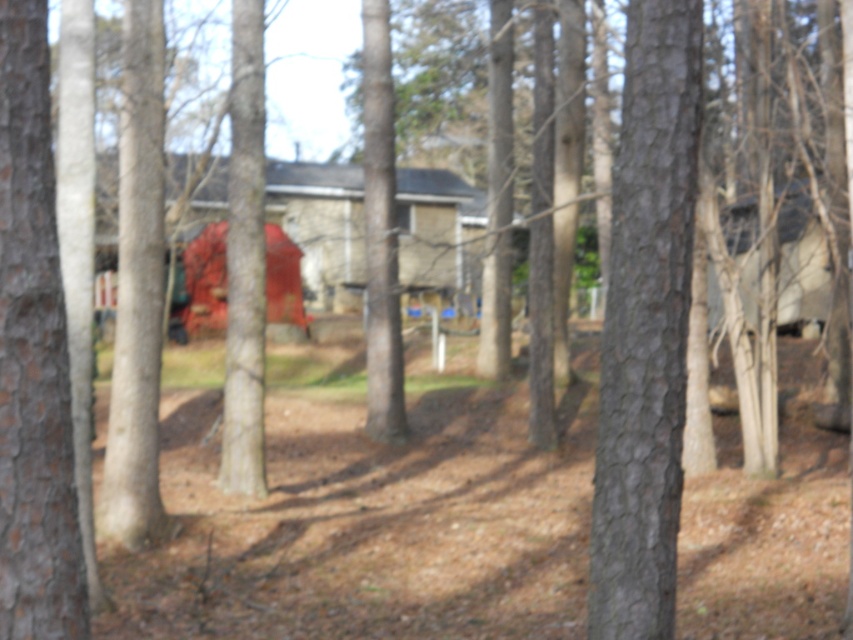
You are a gardener planning to plant a new tree between the smooth bark tree at center and the smooth bark tree at left. The new tree requires a minimum of 5 feet of space between it and any existing trees. Can you plant it there?

The smooth bark tree at center and smooth bark tree at left are 6.00 feet apart from each other. Since the new tree requires at least 5 feet of space, planting it between them would be possible as the existing spacing meets the requirement.

You are standing in a wooded area and see two smooth bark trees. The one at the center and the one at the left. Which direction should you walk to get from the smooth bark tree at left to the smooth bark tree at center?

You should walk to the right to get from the smooth bark tree at left to the smooth bark tree at center because the smooth bark tree at center is to the right of the smooth bark tree at left.